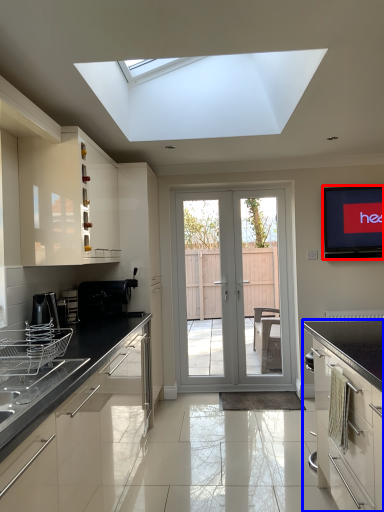
Question: Which of the following is the farthest to the observer, electronic (highlighted by a red box) or cabinetry (highlighted by a blue box)?

Choices:
 (A) electronic
 (B) cabinetry

Answer: (A)